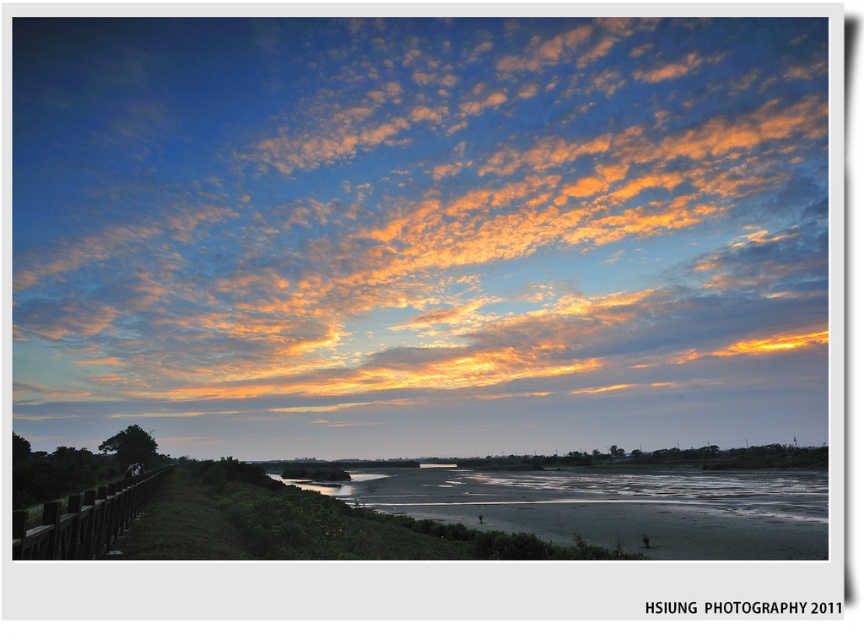
Based on the scene description, which object occupies a larger portion of the image between the cloudy sky at upper center and the sandy brown river at lower center?

The cloudy sky at upper center is bigger than the sandy brown river at lower center, so the cloudy sky at upper center occupies a larger portion of the image.

You are standing on the sandy brown river at lower center and want to walk to the brown wooden fence at lower left. Which direction should you face to walk towards the fence?

You should face towards the left direction to walk towards the brown wooden fence at lower left from the sandy brown river at lower center.